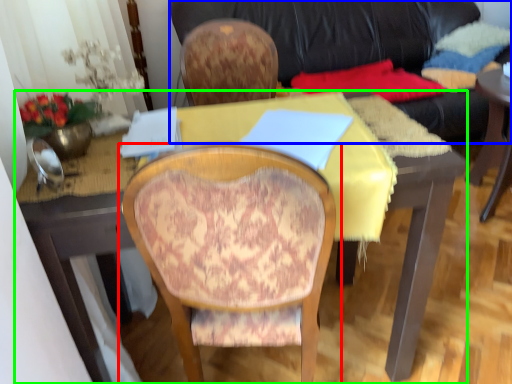
Question: Based on their relative distances, which object is farther from chair (highlighted by a red box)? Choose from studio couch (highlighted by a blue box) and desk (highlighted by a green box).

Choices:
 (A) studio couch
 (B) desk

Answer: (A)